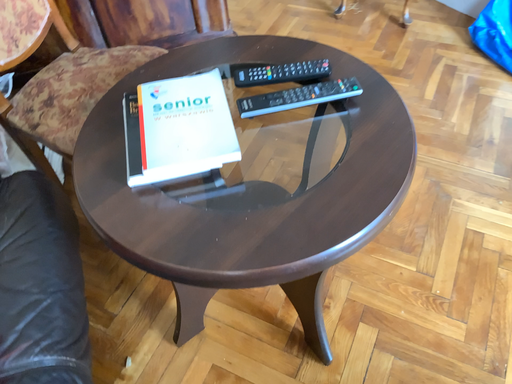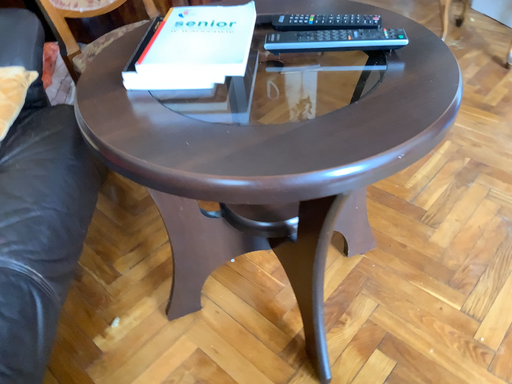
Question: Which way did the camera rotate in the video?

Choices:
 (A) rotated left
 (B) rotated right

Answer: (A)